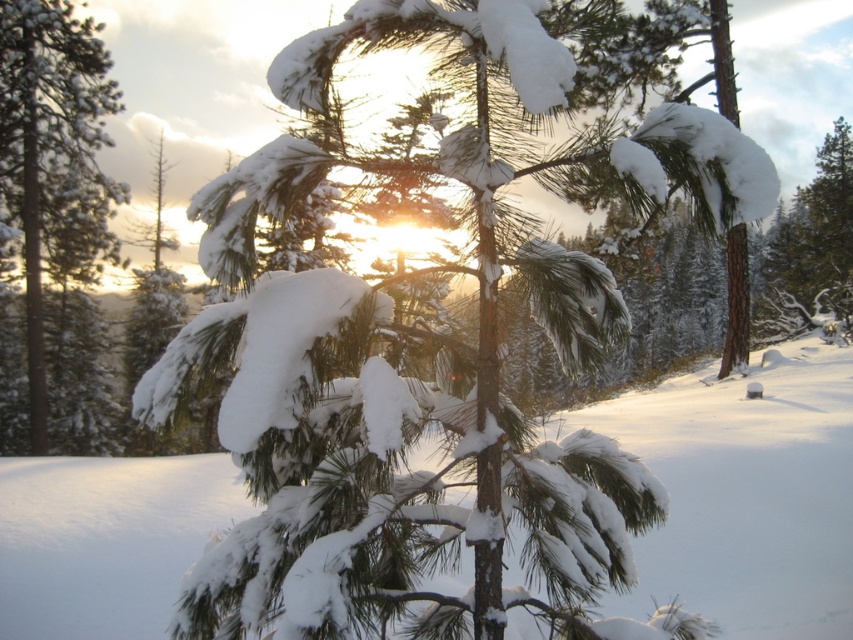
Is point (683, 440) closer to camera compared to point (22, 118)?

Yes.

Who is more distant from viewer, [77,608] or [20,99]?

Point [20,99]

Is point (38, 548) positioned in front of point (84, 145)?

Yes, point (38, 548) is closer to viewer.

The width and height of the screenshot is (853, 640). In order to click on white fluffy snow at center in this screenshot , I will do [746, 493].